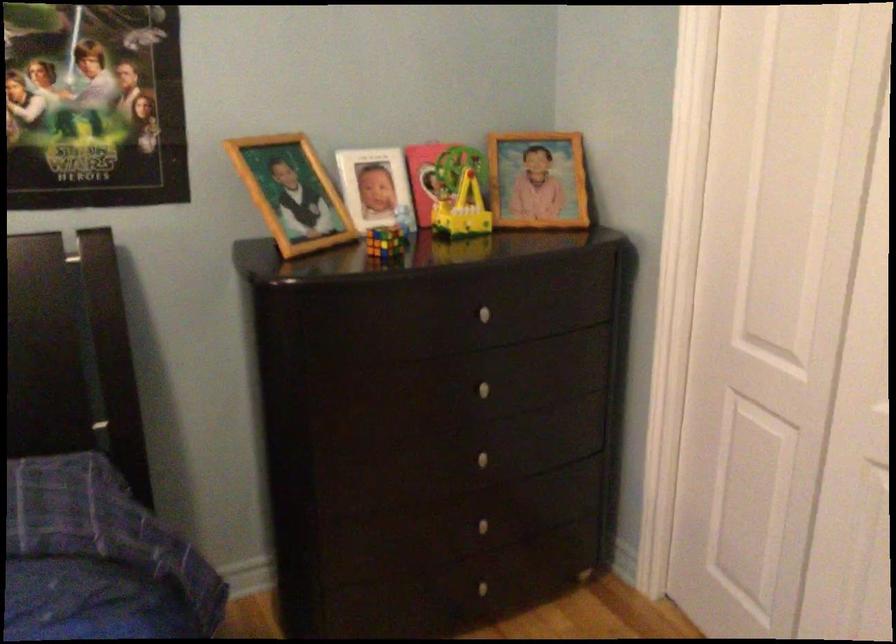
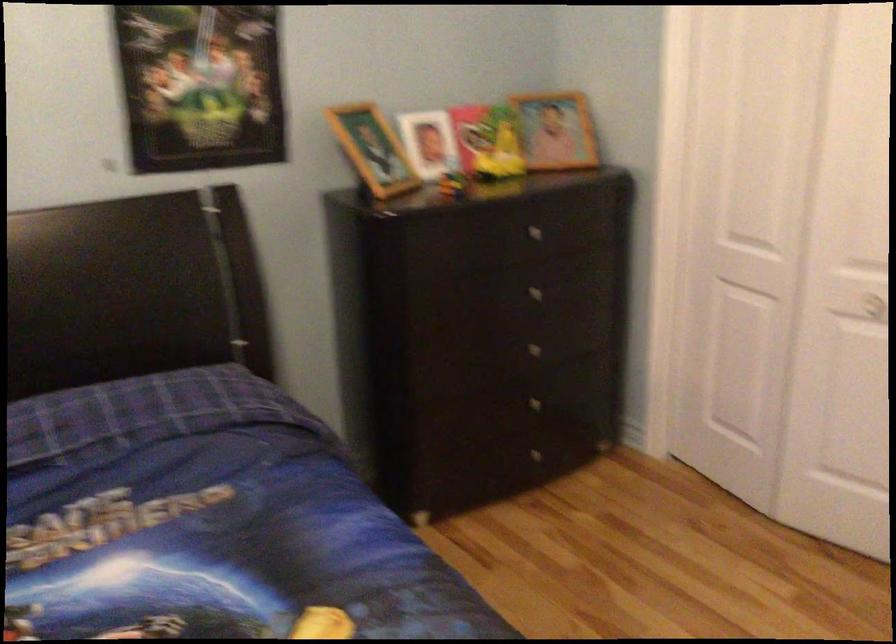
The point at (479,312) is marked in the first image. Where is the corresponding point in the second image?

(530, 230)